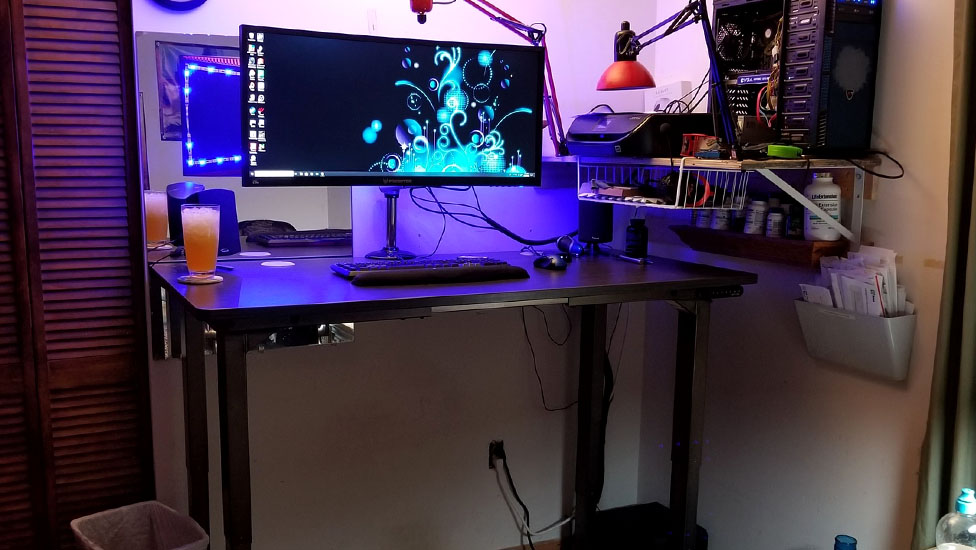
Identify the location of office. This screenshot has height=550, width=976. [549, 277].